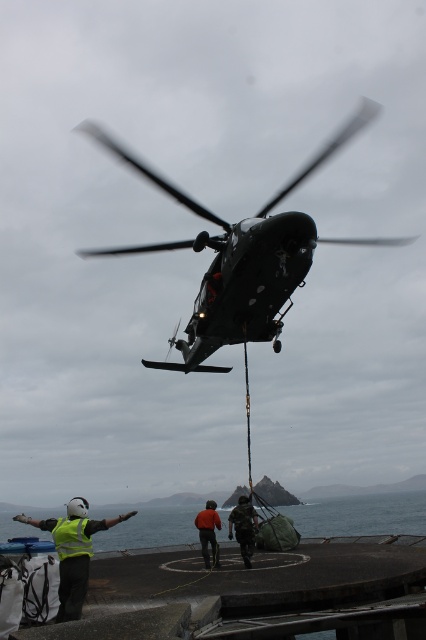
Describe the element at coordinates (242, 257) in the screenshot. The height and width of the screenshot is (640, 426). I see `dark matte helicopter at center` at that location.

Which is behind, point (196, 364) or point (34, 524)?

Positioned behind is point (196, 364).

Image resolution: width=426 pixels, height=640 pixels. Find the location of `dark matte helicopter at center`. dark matte helicopter at center is located at coordinates (242, 257).

Can you confirm if clear blue water at lower center is smaller than dark green uniform at center?

No.

Which is behind, point (9, 525) or point (235, 518)?

The point (9, 525) is behind.

Image resolution: width=426 pixels, height=640 pixels. I want to click on clear blue water at lower center, so click(x=360, y=515).

From the picture: Between dark matte helicopter at center and clear blue water at lower center, which one is positioned higher?

dark matte helicopter at center is higher up.

Who is lower down, dark matte helicopter at center or clear blue water at lower center?

Positioned lower is clear blue water at lower center.

Who is more forward, (253,328) or (357,508)?

Positioned in front is point (253,328).

What are the coordinates of `dark matte helicopter at center` in the screenshot? It's located at (242, 257).